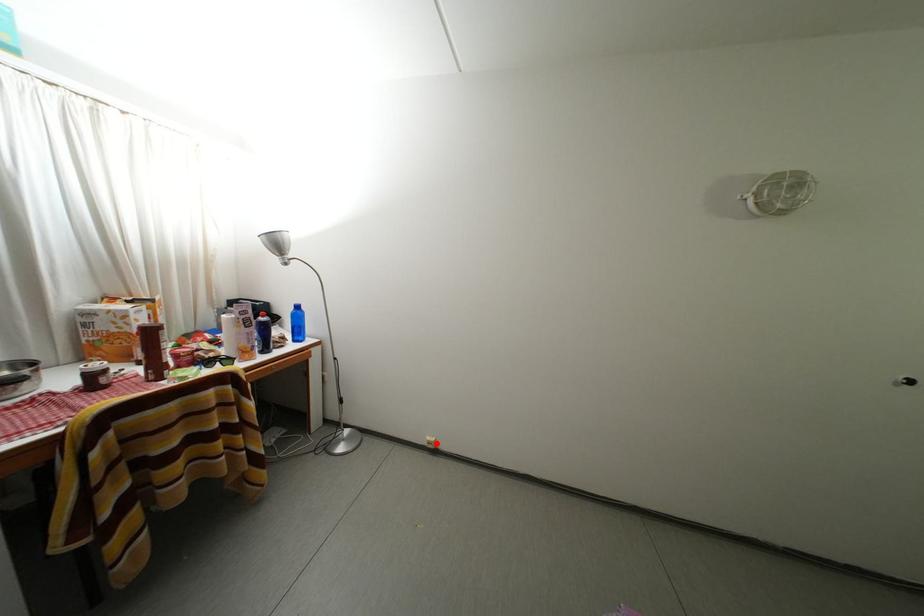
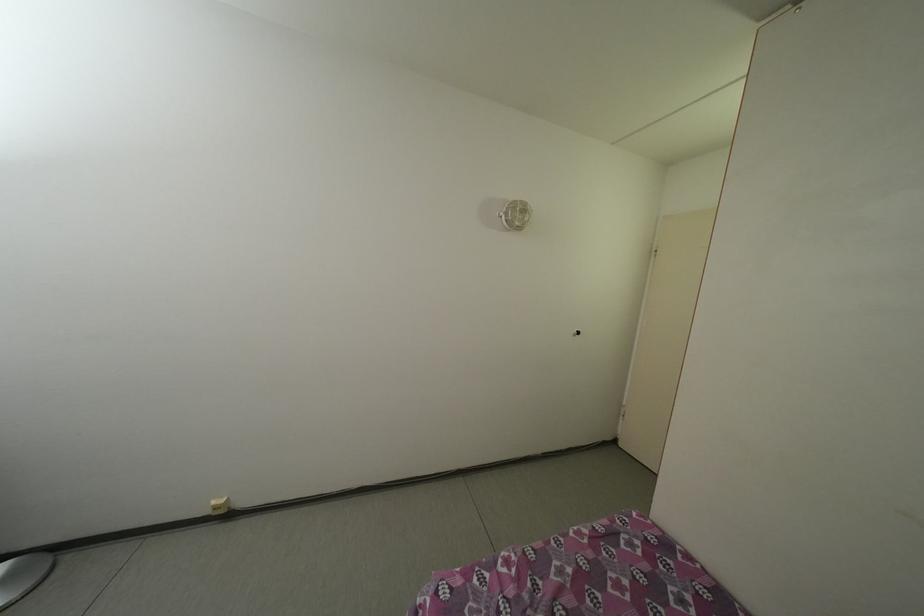
Find the pixel in the second image that matches the highlighted location in the first image.

(222, 508)